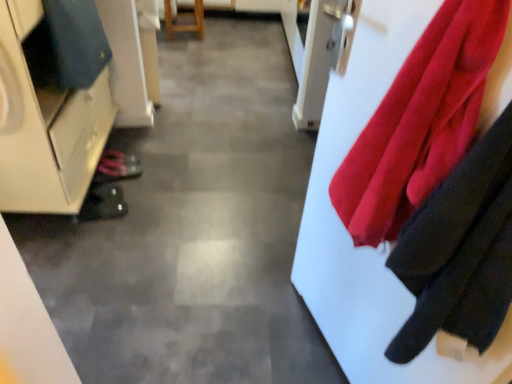
You are a GUI agent. You are given a task and a screenshot of the screen. Output one action in this format:
    pyautogui.click(x=<x>, y=<y>)
    Task: Click on the free space in front of black rubber shoe at lower left, positioned as the 2th shoe in top-to-bottom order
    
    Given the screenshot: What is the action you would take?
    pyautogui.click(x=87, y=238)